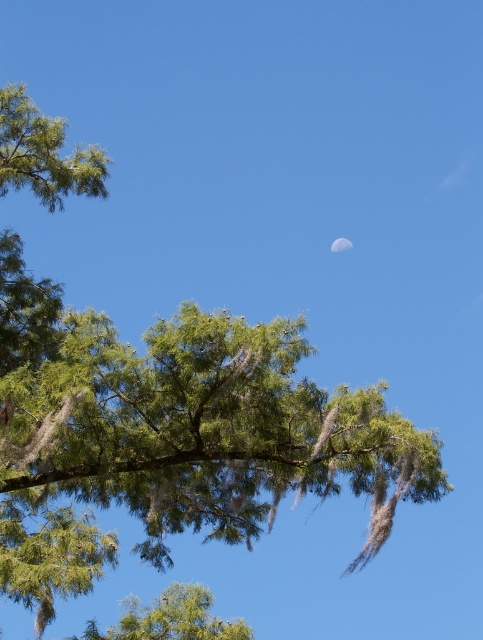
You are an astronomer observing the night sky. You notice the green leafy tree at lower center and the silvery reflective moon at upper center. Which object appears larger in the image?

The green leafy tree at lower center appears larger than the silvery reflective moon at upper center in the image.

You are standing in the scene looking at the point marked as point (x=148, y=608). If you walk 15 meters towards it, will you reach the point?

Yes, because the point (x=148, y=608) is exactly 15.20 meters away from the viewer. Walking 15 meters towards it would get you very close, but not exactly at the point. However, since the distance is 15.20 meters, which is just 0.20 meters more than 15 meters, you would be extremely close but not precisely at the point. However, considering typical measurement precision, it might be considered reached.